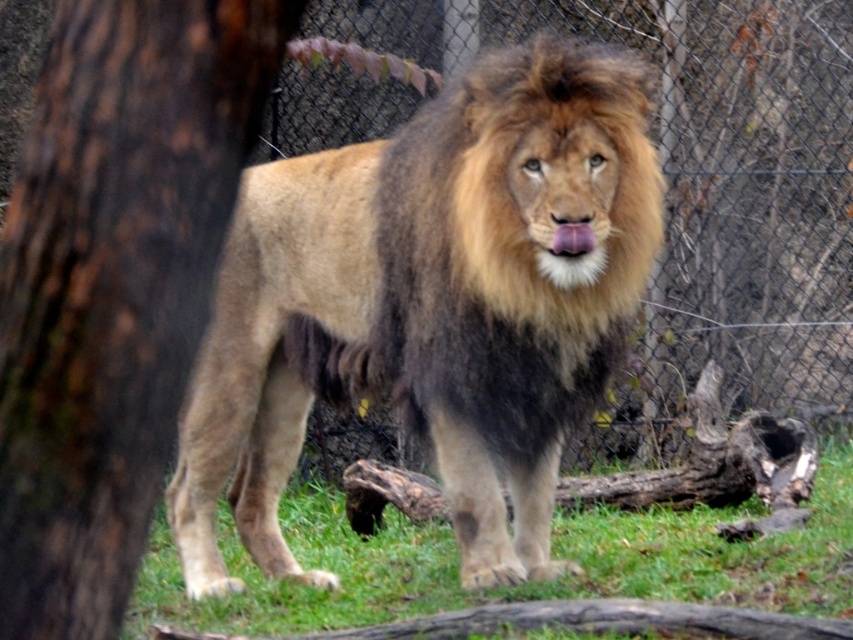
You are a zookeeper who needs to place a new feeding tray for the lion. The tray requires a space of 3 meters between the brown rough bark at left and the green grass at center. Can you place it there?

The distance between the brown rough bark at left and the green grass at center is 3.56 meters, so yes, the feeding tray can be placed there since the required space is 3 meters.

You are a zookeeper planning to place a new feeding station in the enclosure. The feeding station must be placed at point (x=431, y=304). However, there is an object there. What is the object located at that point?

The golden fur lion at center is located at point (x=431, y=304).

In the scene shown: You are a zookeeper who needs to place a new feeding tray for the lion. The feeding tray requires a flat area free of obstacles. Based on the image, is the area near the brown rough bark at left suitable for placing the feeding tray?

The brown rough bark at left is located at point (114,284). Since the description specifies its position but does not mention any flat area or obstacles nearby, it is unclear if the area is suitable. However, the scene mentions the ground is covered with grass and scattered pieces of wood, so there might be uneven terrain or debris. Therefore, the area near the brown rough bark at left may not be suitable for placing the feeding tray due to potential obstacles like scattered wood pieces.